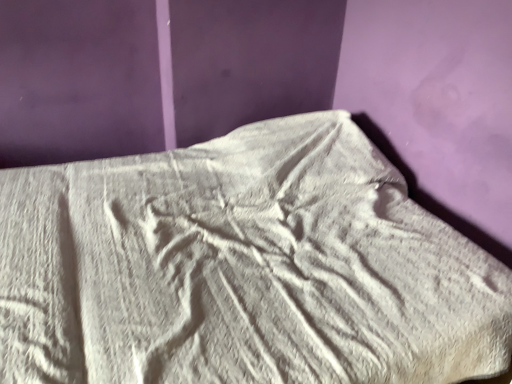
Find the location of a particular element. white textured fabric at center is located at coordinates (243, 268).

Describe the element at coordinates (243, 268) in the screenshot. I see `white textured fabric at center` at that location.

Identify the location of white textured fabric at center. The height and width of the screenshot is (384, 512). (243, 268).